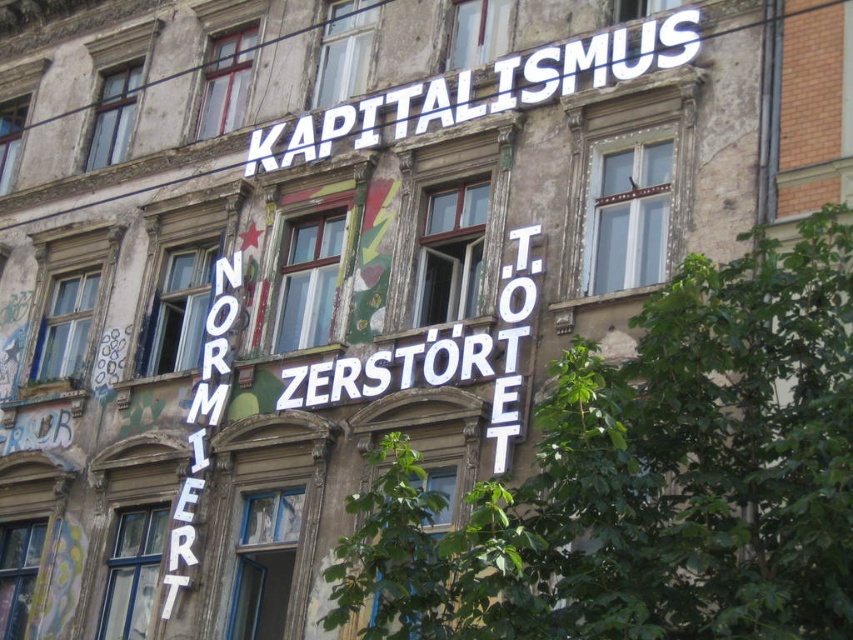
Question: Which of the following is the closest to the observer?

Choices:
 (A) white plastic sign at upper center
 (B) white plastic letters at center
 (C) white neon sign at left

Answer: (B)

Question: Which object is positioned closest to the white neon sign at left?

Choices:
 (A) white plastic letters at center
 (B) white plastic sign at upper center

Answer: (A)

Question: Where is white plastic sign at upper center located in relation to white neon sign at left in the image?

Choices:
 (A) above
 (B) below

Answer: (A)

Question: Is white plastic sign at upper center positioned at the back of white plastic letters at center?

Choices:
 (A) no
 (B) yes

Answer: (B)

Question: Is white plastic sign at upper center to the left of white plastic letters at center from the viewer's perspective?

Choices:
 (A) yes
 (B) no

Answer: (B)

Question: Which point appears farthest from the camera in this image?

Choices:
 (A) (535, 268)
 (B) (192, 422)
 (C) (341, 134)

Answer: (C)